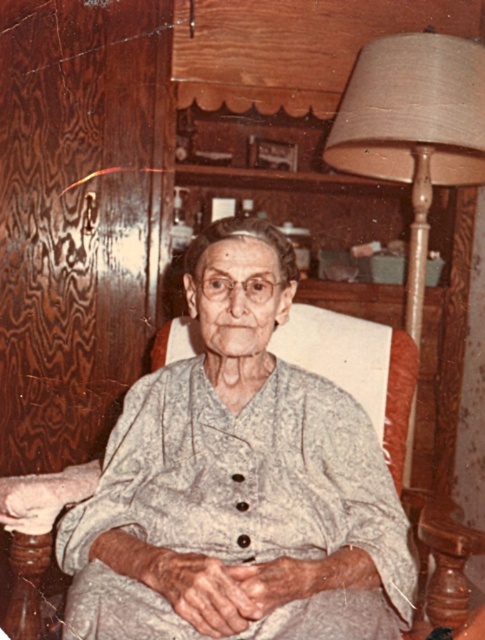
You are an interior designer observing the scene. You need to place a new decorative item between the white textured dress at center and the beige fabric lampshade at right. Can you determine which object is positioned higher in the scene?

The beige fabric lampshade at right is higher than the white textured dress at center, so you should place the decorative item between them below the beige fabric lampshade at right and above the white textured dress at center.

You are an interior designer assessing the layout of this room. You need to place a new decorative item between the white textured dress at center and the beige fabric lampshade at right. Based on their positions, which object should the new item be placed closer to?

The new decorative item should be placed closer to the beige fabric lampshade at right because the white textured dress at center is closer to the viewer, meaning the lampshade is further away, so placing the item closer to the lampshade would maintain a balanced layout.

What is located at the coordinates point (239, 483) in the image?

The white textured dress at center is located at point (239, 483).